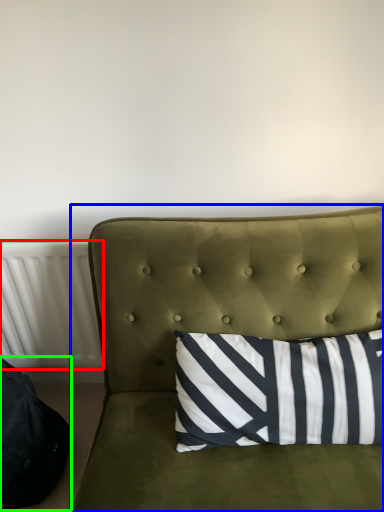
Question: Based on their relative distances, which object is nearer to radiator (highlighted by a red box)? Choose from studio couch (highlighted by a blue box) and bean bag chair (highlighted by a green box).

Choices:
 (A) studio couch
 (B) bean bag chair

Answer: (B)